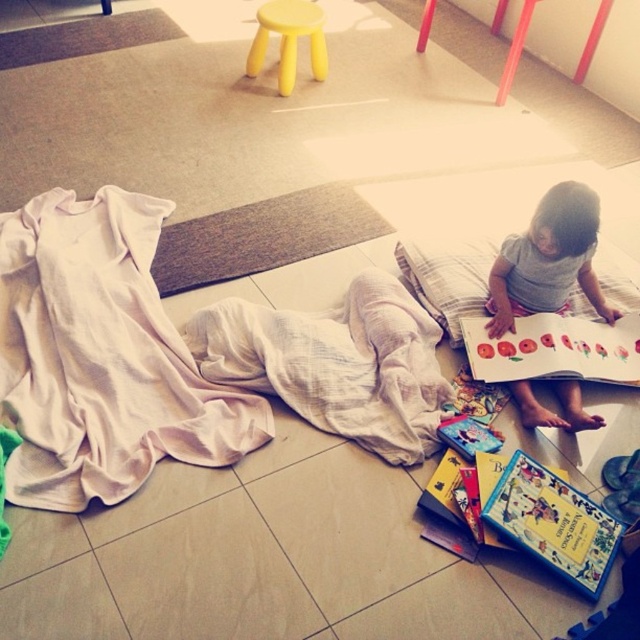
You are a parent trying to organize books in the playroom. You have a hardcover book at lower right and a matte paper book at center. Which book is positioned closer to the floor?

The hardcover book at lower right is positioned closer to the floor because it is below the matte paper book at center.

You are a parent trying to reach the hardcover book at lower right from your current position. The book is on the floor near the child. Can you safely reach it without disturbing the child?

The hardcover book at lower right is 5.06 feet away from camera, so yes, you can safely reach it without disturbing the child as the distance is manageable.

You are a parent trying to tidy up the playroom. You need to move the yellow plastic stool at upper center to the corner. However, you want to avoid stepping on the white cotton blanket at lower left. Can you move the stool without stepping on the blanket?

The white cotton blanket at lower left is below the yellow plastic stool at upper center, so moving the stool would require lifting it over the blanket or moving around it, but since the stool is above the blanket, you can carefully move it without stepping on the blanket as long as you don